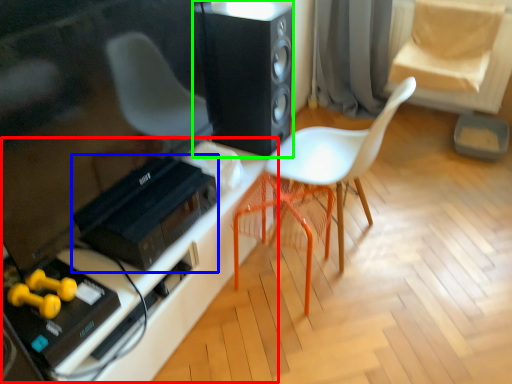
Question: Estimate the real-world distances between objects in this image. Which object is farther from table (highlighted by a red box), stereo (highlighted by a blue box) or loudspeaker (highlighted by a green box)?

Choices:
 (A) stereo
 (B) loudspeaker

Answer: (B)